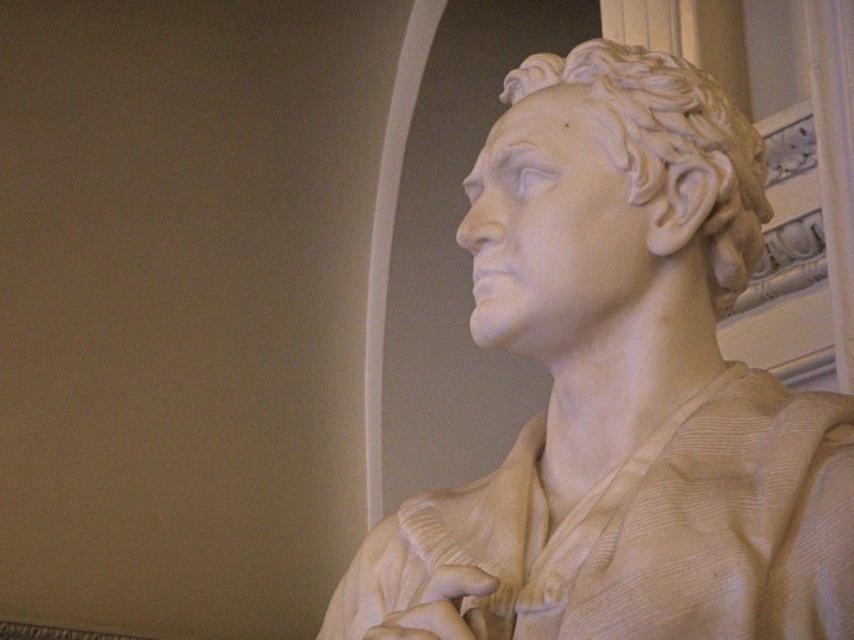
Question: Is white marble bust at right bigger than white marble head at center?

Choices:
 (A) yes
 (B) no

Answer: (A)

Question: Among these objects, which one is farthest from the camera?

Choices:
 (A) white marble bust at right
 (B) white marble head at center

Answer: (B)

Question: Is white marble bust at right bigger than white marble head at center?

Choices:
 (A) no
 (B) yes

Answer: (B)

Question: Is white marble bust at right to the left of white marble head at center from the viewer's perspective?

Choices:
 (A) yes
 (B) no

Answer: (A)